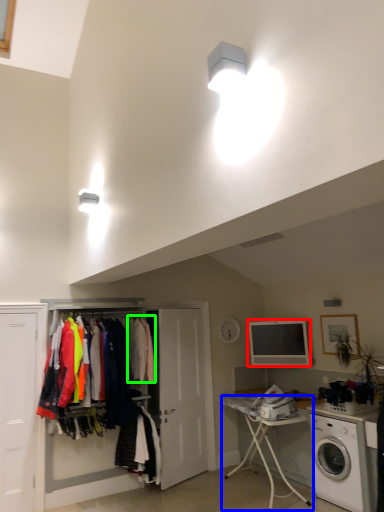
Question: Estimate the real-world distances between objects in this image. Which object is farther from appliance (highlighted by a red box), table (highlighted by a blue box) or clothing (highlighted by a green box)?

Choices:
 (A) table
 (B) clothing

Answer: (B)